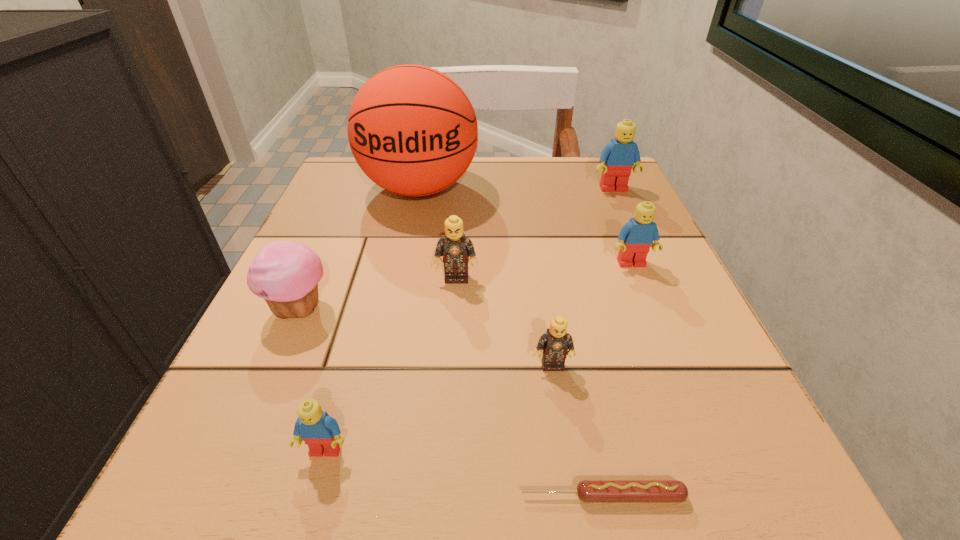
Where is `vacant region between the farthest Lego and the third Lego from right to left`? This screenshot has height=540, width=960. vacant region between the farthest Lego and the third Lego from right to left is located at coordinates (583, 277).

The image size is (960, 540). In order to click on object that is the fifth nearest to the cupcake in this screenshot , I will do `click(589, 491)`.

Select which object is the closest to the pink cupcake. Please provide its 2D coordinates. Your answer should be formatted as a tuple, i.e. [(x, y)], where the tuple contains the x and y coordinates of a point satisfying the conditions above.

[(455, 248)]

Locate which Lego is the third closest to the smaller tan Lego. Please provide its 2D coordinates. Your answer should be formatted as a tuple, i.e. [(x, y)], where the tuple contains the x and y coordinates of a point satisfying the conditions above.

[(318, 430)]

Identify which Lego is the second nearest to the third farthest Lego. Please provide its 2D coordinates. Your answer should be formatted as a tuple, i.e. [(x, y)], where the tuple contains the x and y coordinates of a point satisfying the conditions above.

[(636, 237)]

Where is `blue Lego that is the second closest to the second farthest Lego`? blue Lego that is the second closest to the second farthest Lego is located at coordinates (318, 430).

Point out which blue Lego is positioned as the second nearest to the brown sausage. Please provide its 2D coordinates. Your answer should be formatted as a tuple, i.e. [(x, y)], where the tuple contains the x and y coordinates of a point satisfying the conditions above.

[(636, 237)]

The width and height of the screenshot is (960, 540). I want to click on free space that satisfies the following two spatial constraints: 1. in front of the nearer tan Lego; 2. on the right side of the shortest object, so click(x=572, y=496).

This screenshot has height=540, width=960. What are the coordinates of `free region that satisfies the following two spatial constraints: 1. on the side with logo of the tallest object; 2. on the right side of the shortest object` in the screenshot? It's located at (357, 496).